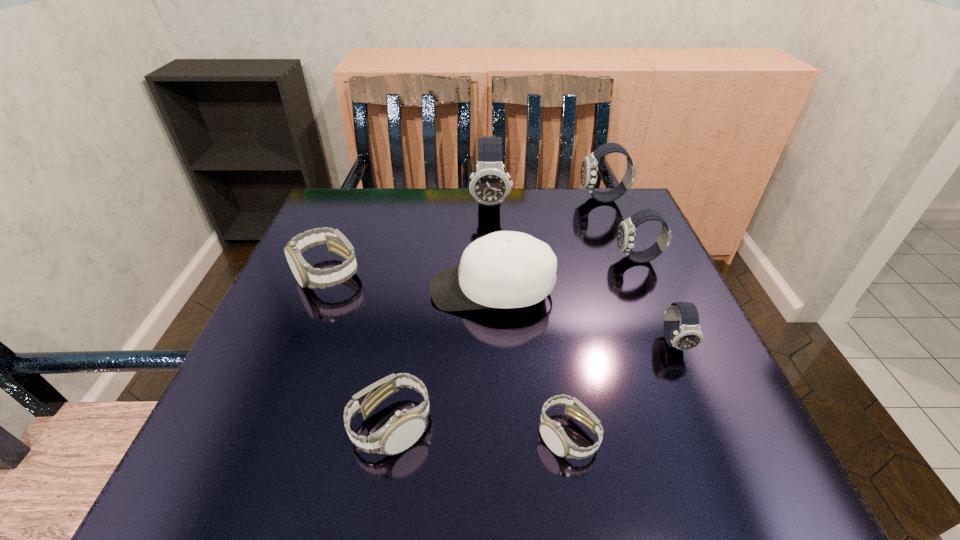
Locate an element on the screen. The height and width of the screenshot is (540, 960). the tallest object is located at coordinates (959, 0).

Image resolution: width=960 pixels, height=540 pixels. I want to click on the third watch from left to right, so click(x=959, y=0).

Locate an element on the screen. the sixth shortest watch is located at coordinates (959, 0).

This screenshot has width=960, height=540. I want to click on baseball cap, so click(959, 0).

Image resolution: width=960 pixels, height=540 pixels. Find the location of `the second nearest dark watch`. the second nearest dark watch is located at coordinates (959, 0).

You are a GUI agent. You are given a task and a screenshot of the screen. Output one action in this format:
    pyautogui.click(x=<x>, y=<y>)
    Task: Click on the leftmost watch
    Image resolution: width=960 pixels, height=540 pixels.
    Given the screenshot: What is the action you would take?
    pyautogui.click(x=959, y=0)

Find the location of a particular element. Image resolution: width=960 pixels, height=540 pixels. the leftmost object is located at coordinates coord(959,0).

What are the coordinates of `the sixth farthest object` in the screenshot? It's located at (959, 539).

Locate an element on the screen. the smallest dark watch is located at coordinates (959, 539).

Find the location of a particular element. The height and width of the screenshot is (540, 960). the second smallest white watch is located at coordinates (959, 0).